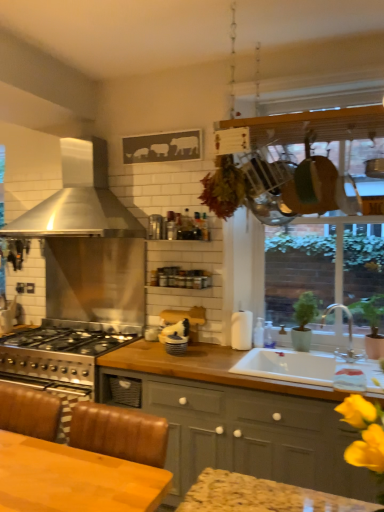
Locate an element on the screen. The height and width of the screenshot is (512, 384). vacant area that lies in front of green matte plant at sink, which is counted as the second plant, starting from the right is located at coordinates (315, 358).